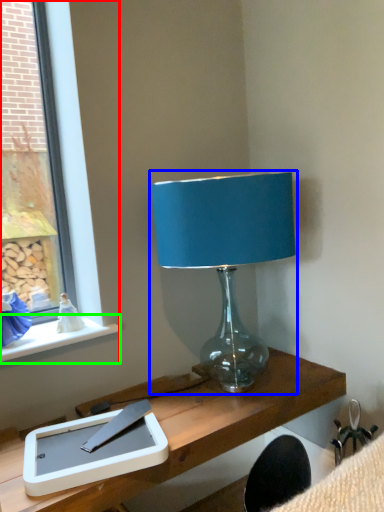
Question: Estimate the real-world distances between objects in this image. Which object is closer to window (highlighted by a red box), lamp (highlighted by a blue box) or window sill (highlighted by a green box)?

Choices:
 (A) lamp
 (B) window sill

Answer: (B)